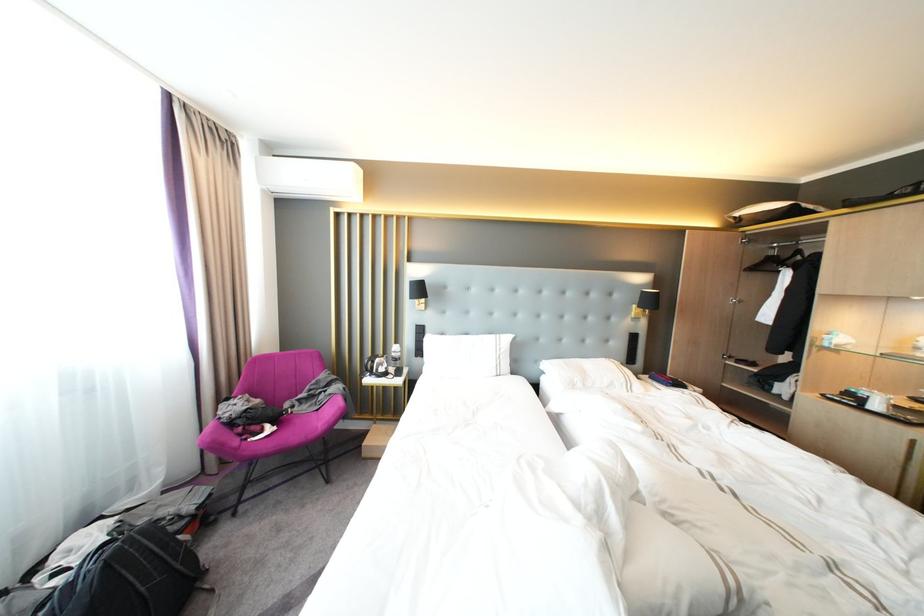
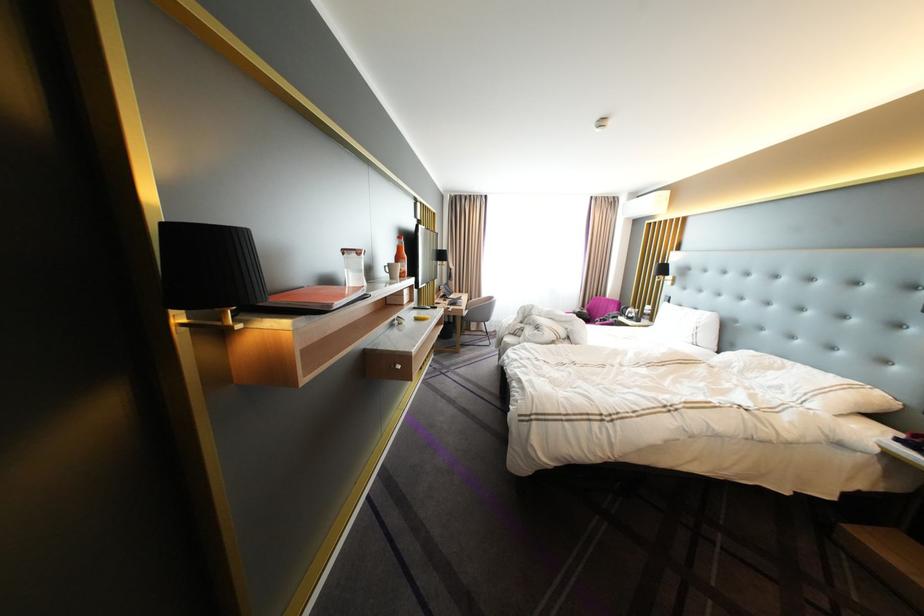
Find the pixel in the second image that matches point 258,411 in the first image.

(590, 313)